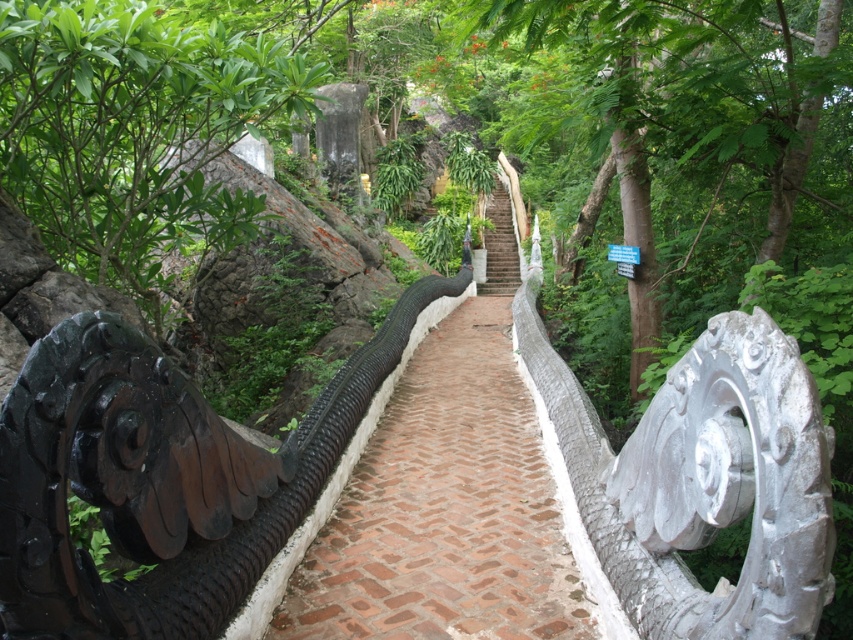
Can you confirm if green leafy tree at center is positioned below white stone stairs at center?

Actually, green leafy tree at center is above white stone stairs at center.

Is point (677, 280) closer to camera compared to point (496, 216)?

Yes, point (677, 280) is closer to viewer.

The height and width of the screenshot is (640, 853). In order to click on green leafy tree at center in this screenshot , I will do `click(688, 136)`.

Which is more to the left, brick paved path at center or green leafy tree at left?

Positioned to the left is green leafy tree at left.

Does point (277, 627) come closer to viewer compared to point (169, 284)?

Yes, point (277, 627) is in front of point (169, 284).

Locate an element on the screen. The width and height of the screenshot is (853, 640). brick paved path at center is located at coordinates (453, 506).

Which is in front, point (606, 369) or point (239, 99)?

Point (239, 99)

Between point (686, 216) and point (167, 182), which one is positioned behind?

Positioned behind is point (167, 182).

This screenshot has width=853, height=640. I want to click on green leafy tree at center, so click(x=688, y=136).

I want to click on green leafy tree at center, so click(x=688, y=136).